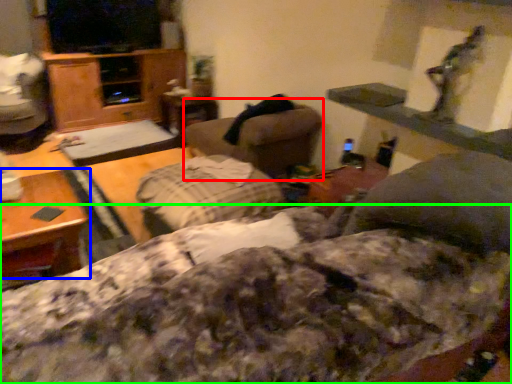
Question: Which object is the farthest from swivel chair (highlighted by a red box)? Choose among these: table (highlighted by a blue box) or bedding (highlighted by a green box).

Choices:
 (A) table
 (B) bedding

Answer: (B)